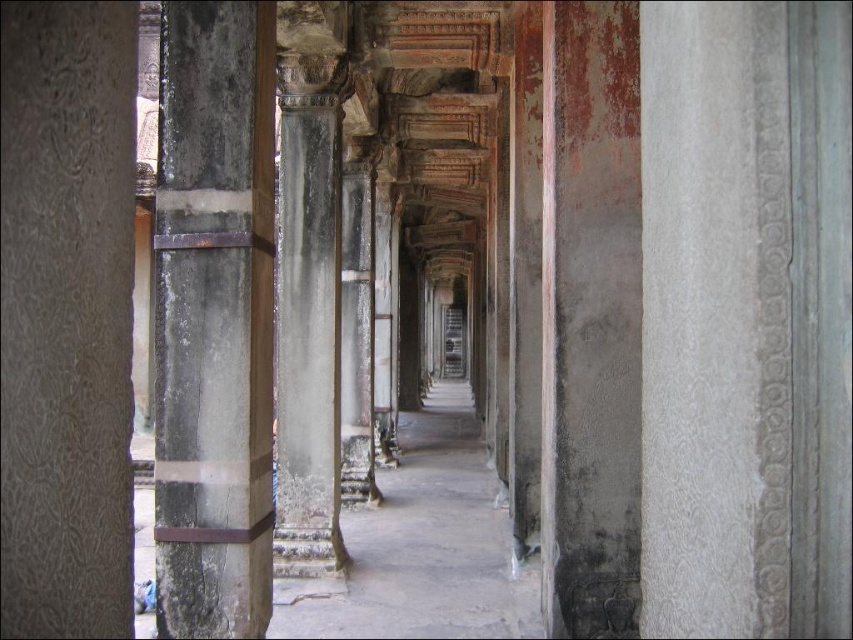
You are an archaeologist examining the ancient temple corridor. You notice a point marked at coordinates (67,316). Based on the scene description, what object does this point most likely correspond to?

The point at coordinates (67,316) most likely corresponds to the gray textured stone pillar at left as described in the scene.

You are an archaeologist examining the ancient temple corridor. You notice two pillars on your left side. One is labeled as gray textured stone pillar at left and the other as dark gray stone pillar at left. Based on their positions, which pillar is positioned higher up?

The gray textured stone pillar at left is above the dark gray stone pillar at left, so it is positioned higher up.

You are an archaeologist examining the ancient temple corridor. You notice two pillars on your left side. One is labeled as gray textured stone pillar at left and the other as dark gray stone pillar at left. Which pillar is shorter in height?

The gray textured stone pillar at left is shorter in height compared to the dark gray stone pillar at left.